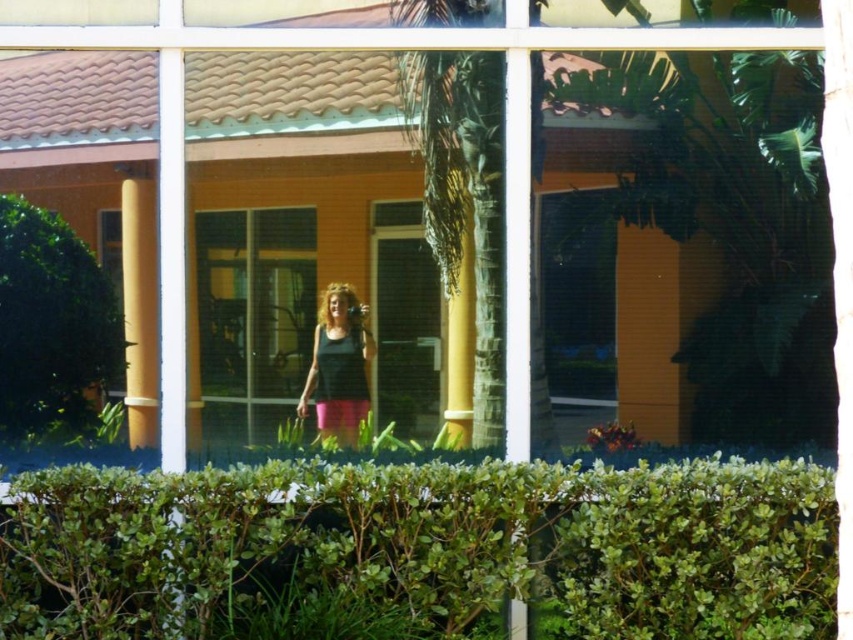
Does green leafy hedge at lower center have a lesser height compared to clear glass window at center?

Correct, green leafy hedge at lower center is not as tall as clear glass window at center.

Is green leafy hedge at lower center closer to the viewer compared to clear glass window at center?

Yes, it is in front of clear glass window at center.

Between point (722, 467) and point (265, 237), which one is positioned behind?

Positioned behind is point (265, 237).

This screenshot has width=853, height=640. I want to click on green leafy hedge at lower center, so click(428, 545).

Between point (7, 346) and point (259, 243), which one is positioned behind?

The point (259, 243) is behind.

Is point (1, 428) in front of point (305, 317)?

Yes, it is in front of point (305, 317).

You are a GUI agent. You are given a task and a screenshot of the screen. Output one action in this format:
    pyautogui.click(x=<x>, y=<y>)
    Task: Click on the green leafy bush at left
    The image size is (853, 640).
    Given the screenshot: What is the action you would take?
    pyautogui.click(x=51, y=324)

Is clear glass window at center bigger than black matte tank top at center?

Yes, clear glass window at center is bigger than black matte tank top at center.

Does clear glass window at center have a greater height compared to black matte tank top at center?

Yes, clear glass window at center is taller than black matte tank top at center.

Which is in front, point (231, 314) or point (341, 422)?

Point (231, 314) is in front.

Where is `clear glass window at center`? Image resolution: width=853 pixels, height=640 pixels. clear glass window at center is located at coordinates (254, 305).